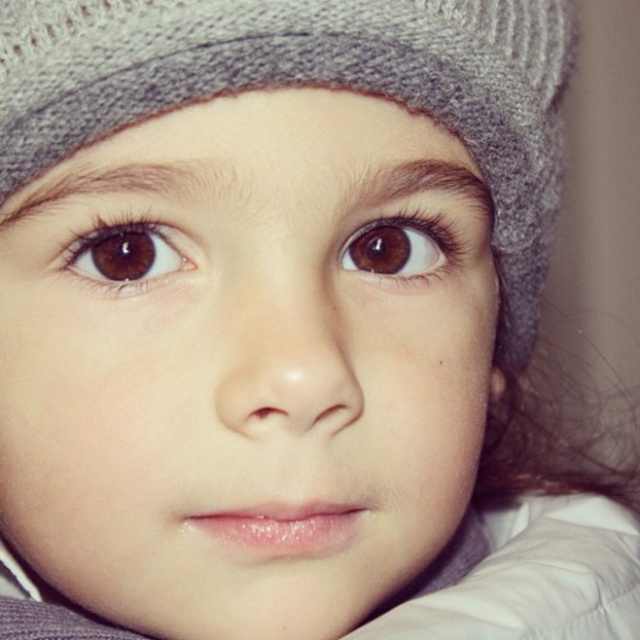
Question: Among these points, which one is nearest to the camera?

Choices:
 (A) (419, 227)
 (B) (74, 241)

Answer: (B)

Question: Is brown matte eye at upper left bigger than brown matte eye at upper center?

Choices:
 (A) no
 (B) yes

Answer: (A)

Question: Is brown matte eye at upper left above brown matte eye at upper center?

Choices:
 (A) no
 (B) yes

Answer: (A)

Question: Which of the following is the closest to the observer?

Choices:
 (A) (124, 237)
 (B) (355, 244)

Answer: (A)

Question: Can you confirm if brown matte eye at upper left is bigger than brown matte eye at upper center?

Choices:
 (A) no
 (B) yes

Answer: (A)